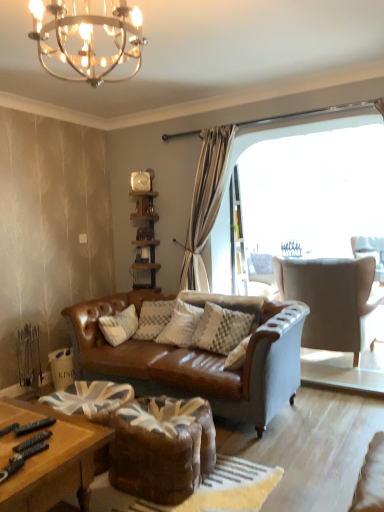
You are a GUI agent. You are given a task and a screenshot of the screen. Output one action in this format:
    pyautogui.click(x=<x>, y=<y>)
    Task: Click on the free point above woodenshelf at center (from a real-world perspective)
    This screenshot has width=384, height=512.
    Given the screenshot: What is the action you would take?
    pyautogui.click(x=140, y=190)